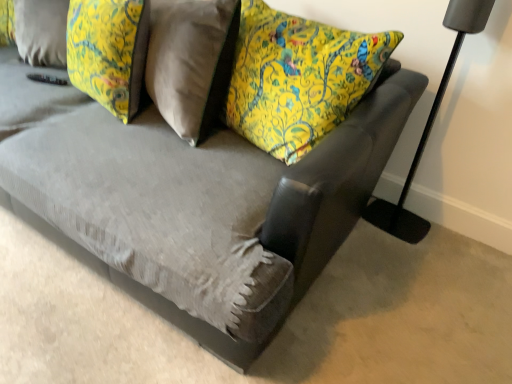
The height and width of the screenshot is (384, 512). I want to click on vacant space in front of matte black floor lamp at right, so click(x=401, y=257).